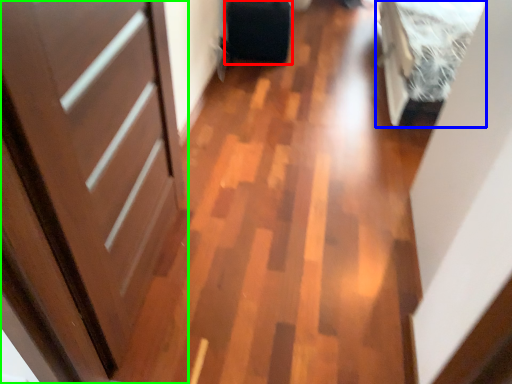
Question: Based on their relative distances, which object is farther from luggage (highlighted by a red box)? Choose from bed (highlighted by a blue box) and door (highlighted by a green box).

Choices:
 (A) bed
 (B) door

Answer: (B)